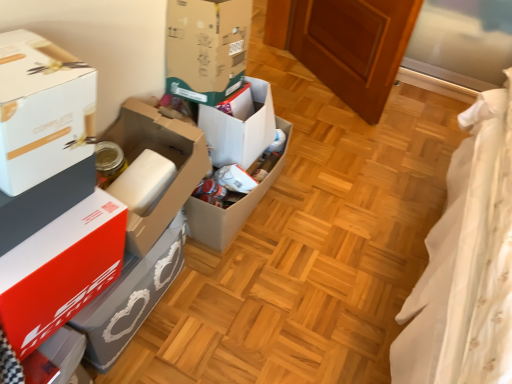
The image size is (512, 384). What are the coordinates of `free space in front of cardboard box at center, placed as the second box when sorted from back to front` in the screenshot? It's located at (250, 297).